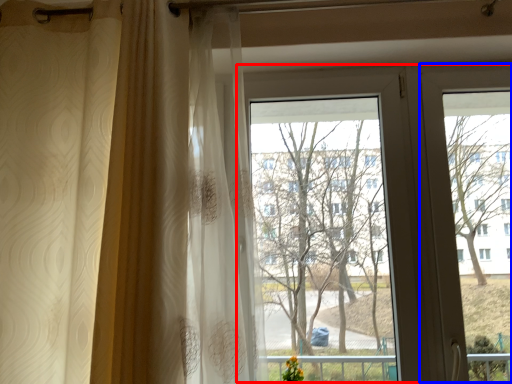
Question: Which point is further to the camera, bay window (highlighted by a red box) or screen door (highlighted by a blue box)?

Choices:
 (A) bay window
 (B) screen door

Answer: (B)